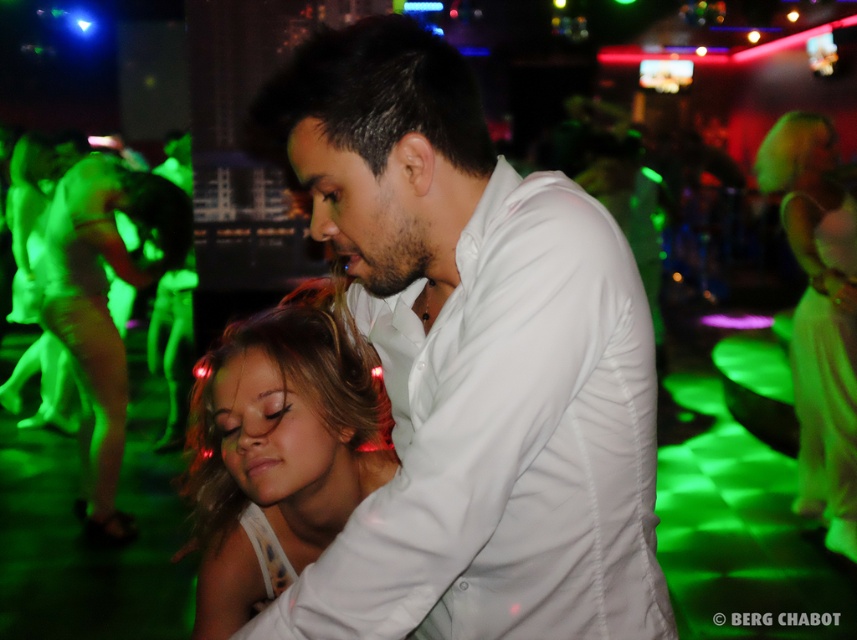
Find the location of a particular element. blonde hair at center is located at coordinates (279, 454).

Is blonde hair at center positioned at the back of matte green dress at left?

That is False.

The height and width of the screenshot is (640, 857). What do you see at coordinates (279, 454) in the screenshot?
I see `blonde hair at center` at bounding box center [279, 454].

Find the location of a particular element. The height and width of the screenshot is (640, 857). blonde hair at center is located at coordinates (279, 454).

Does point (469, 113) come behind point (280, 356)?

That is False.

Is point (462, 259) positioned before point (324, 413)?

Yes, it is in front of point (324, 413).

What do you see at coordinates (472, 364) in the screenshot?
I see `white smooth shirt at center` at bounding box center [472, 364].

At what (x,y) coordinates should I click in order to perform the action: click on white smooth shirt at center. Please return your answer as a coordinate pair (x, y). The width and height of the screenshot is (857, 640). Looking at the image, I should click on (472, 364).

Looking at this image, who is positioned more to the left, blonde hair at center or silky white dress at center?

Positioned to the left is blonde hair at center.

Does point (310, 308) come in front of point (843, 502)?

Yes, it is.

At what (x,y) coordinates should I click in order to perform the action: click on blonde hair at center. Please return your answer as a coordinate pair (x, y). Image resolution: width=857 pixels, height=640 pixels. Looking at the image, I should click on (279, 454).